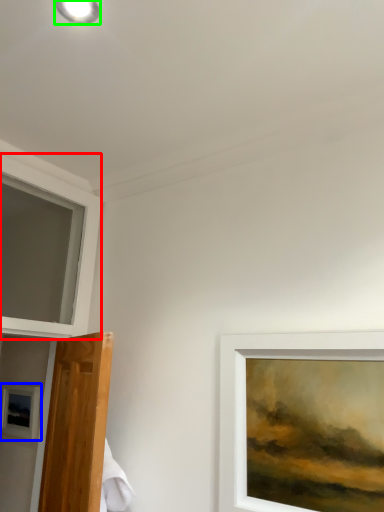
Question: Estimate the real-world distances between objects in this image. Which object is closer to window (highlighted by a red box), picture frame (highlighted by a blue box) or droplight (highlighted by a green box)?

Choices:
 (A) picture frame
 (B) droplight

Answer: (A)